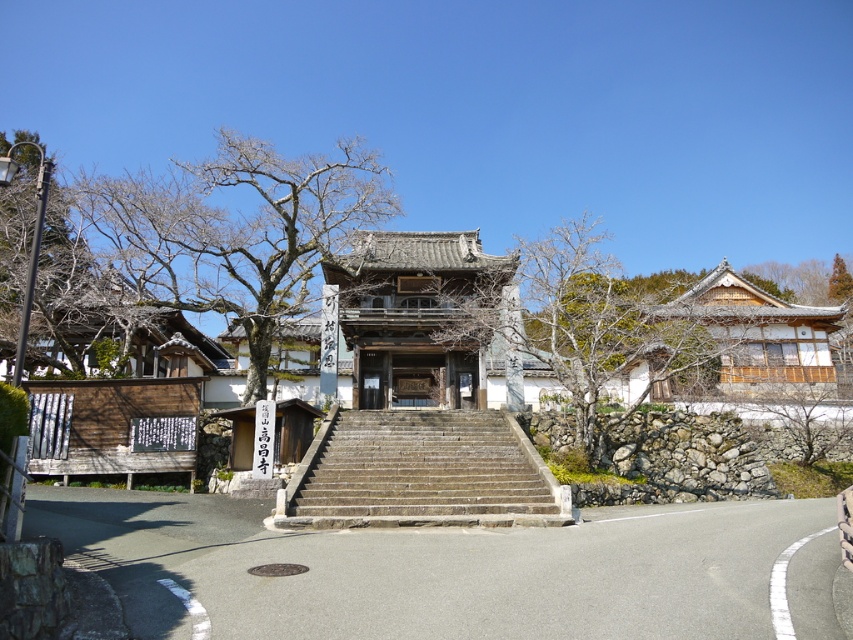
You are a tourist visiting the temple and want to take a photo of both the stone textured stairs at center and the wooden temple at center. Which one should you zoom in on more to ensure both fit in the frame?

Since the stone textured stairs at center is smaller than the wooden temple at center, you should zoom in more on the wooden temple at center to ensure both fit in the frame.